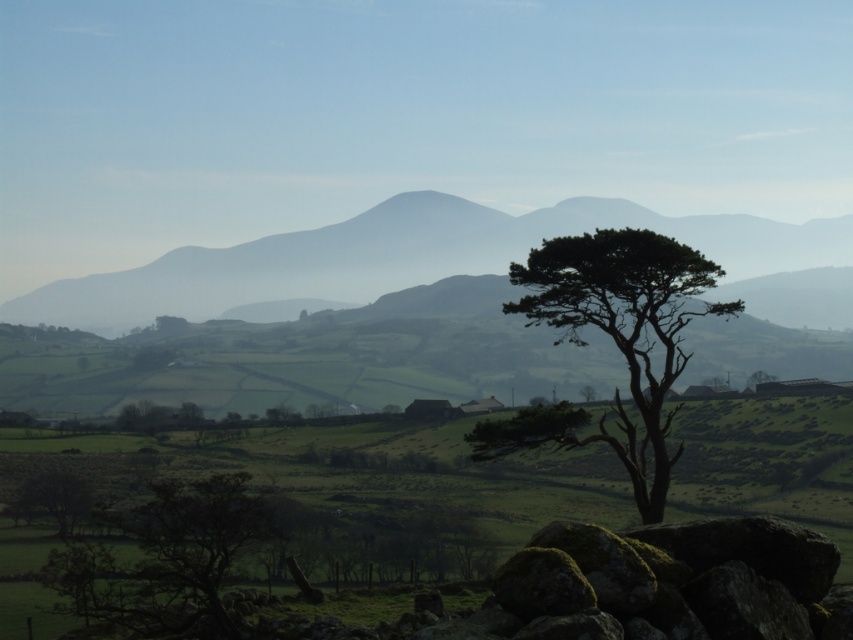
Question: Which point is farther to the camera?

Choices:
 (A) (637, 321)
 (B) (16, 490)
 (C) (465, 232)

Answer: (C)

Question: Is dark green textured tree at center in front of green leafy tree at lower left?

Choices:
 (A) no
 (B) yes

Answer: (B)

Question: Which object appears closest to the camera in this image?

Choices:
 (A) green leafy tree at lower left
 (B) silvery gray mountain at center

Answer: (B)

Question: Which object is positioned closest to the green leafy tree at lower left?

Choices:
 (A) dark green textured tree at center
 (B) silvery gray mountain at center
 (C) green leafy tree at center

Answer: (A)

Question: Can you confirm if silvery gray mountain at center is positioned to the left of green leafy tree at lower left?

Choices:
 (A) yes
 (B) no

Answer: (B)

Question: Can you confirm if dark green textured tree at center is positioned below green leafy tree at lower left?

Choices:
 (A) no
 (B) yes

Answer: (A)